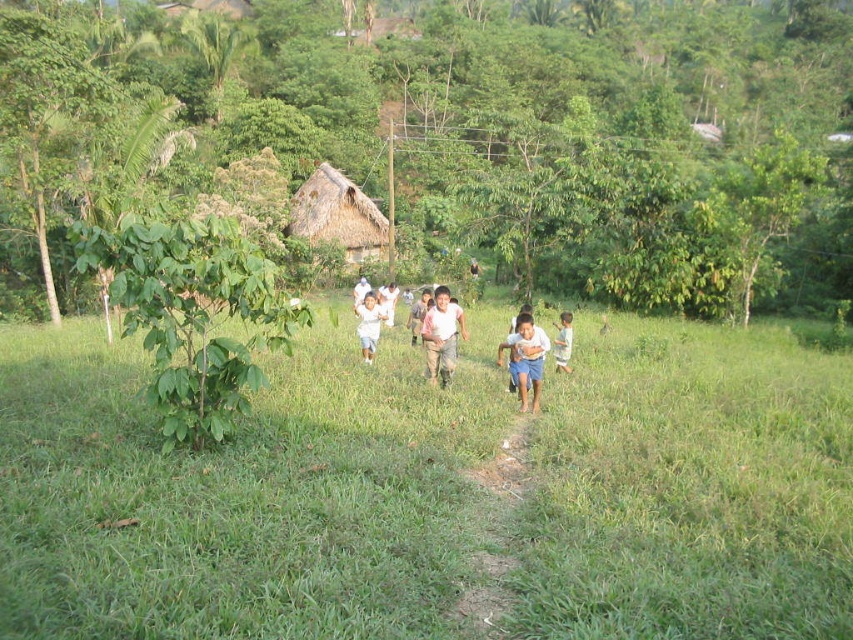
Question: Is green grass at center thinner than light brown wooden stick at center?

Choices:
 (A) no
 (B) yes

Answer: (A)

Question: Is green grass at center further to the viewer compared to white cotton shirt at center?

Choices:
 (A) no
 (B) yes

Answer: (A)

Question: Which object appears farthest from the camera in this image?

Choices:
 (A) thatched straw hut at center
 (B) light brown wooden stick at center

Answer: (A)

Question: Which of the following is the farthest from the observer?

Choices:
 (A) dirt path at center
 (B) green grass at center
 (C) light blue shorts at center
 (D) light blue cotton shirt at center

Answer: (C)

Question: Among these points, which one is nearest to the camera?

Choices:
 (A) (566, 321)
 (B) (496, 532)
 (C) (358, 330)
 (D) (416, 323)

Answer: (B)

Question: Is dirt path at center positioned before light brown wooden stick at center?

Choices:
 (A) no
 (B) yes

Answer: (B)